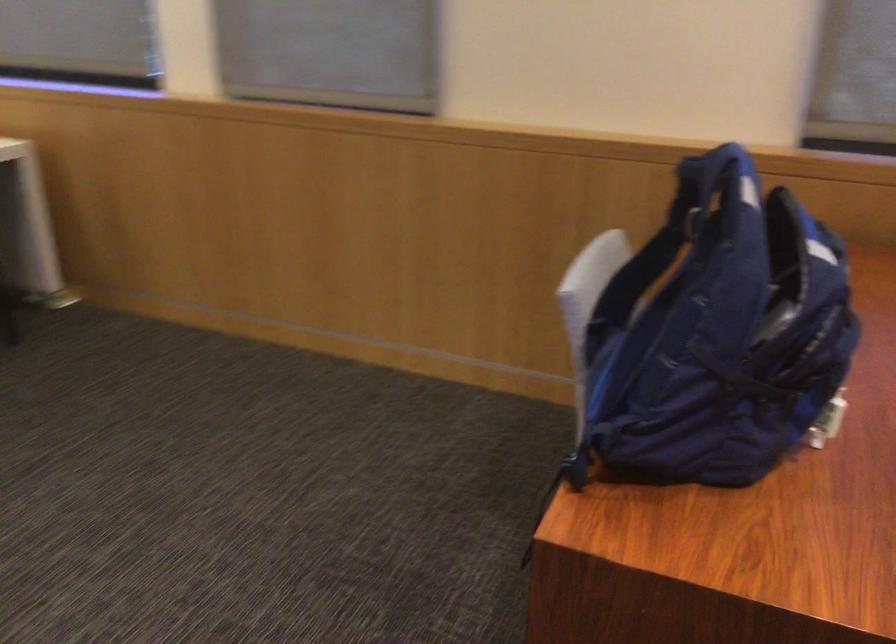
Locate an element on the screen. This screenshot has width=896, height=644. backpack top handle is located at coordinates (730, 178).